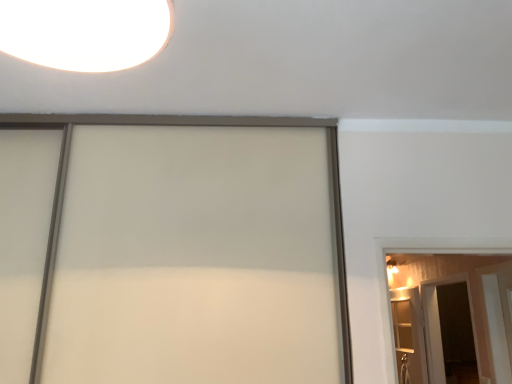
Question: From the image's perspective, is white glossy barn door at right located above or below wooden elevator at right?

Choices:
 (A) below
 (B) above

Answer: (B)

Question: Is white glossy barn door at right wider or thinner than wooden elevator at right?

Choices:
 (A) wide
 (B) thin

Answer: (A)

Question: Estimate the real-world distances between objects in this image. Which object is closer to the wooden elevator at right?

Choices:
 (A) white glossy barn door at right
 (B) transparent glass screen door at lower right

Answer: (B)

Question: Which is farther from the wooden elevator at right?

Choices:
 (A) white glossy barn door at right
 (B) transparent glass screen door at lower right

Answer: (A)